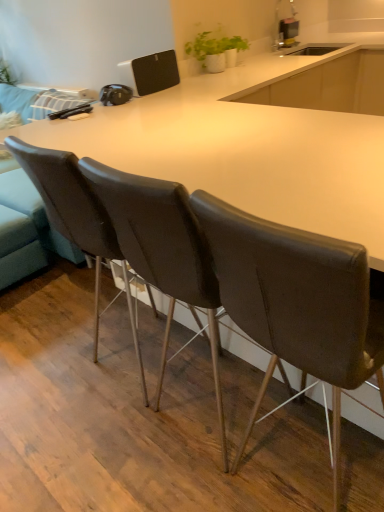
Question: Does metallic silver toaster at upper center have a greater height compared to leather at center, the 2th chair in the left-to-right sequence?

Choices:
 (A) no
 (B) yes

Answer: (A)

Question: Is metallic silver toaster at upper center not close to leather at center, the 2th chair in the left-to-right sequence?

Choices:
 (A) no
 (B) yes

Answer: (B)

Question: From a real-world perspective, is metallic silver toaster at upper center positioned under leather at center, the 2th chair positioned from the right, based on gravity?

Choices:
 (A) no
 (B) yes

Answer: (A)

Question: Does metallic silver toaster at upper center have a lesser width compared to leather at center, the 2th chair positioned from the right?

Choices:
 (A) no
 (B) yes

Answer: (B)

Question: Is leather at center, the 2th chair positioned from the right, located within metallic silver toaster at upper center?

Choices:
 (A) yes
 (B) no

Answer: (B)

Question: Is metallic silver toaster at upper center positioned behind leather at center, the 2th chair positioned from the right?

Choices:
 (A) no
 (B) yes

Answer: (B)

Question: Is leather at left, which appears as the 1th chair when viewed from the left, far from metallic silver toaster at upper center?

Choices:
 (A) no
 (B) yes

Answer: (B)

Question: Could you tell me if leather at left, the 3th chair when ordered from right to left, is turned towards metallic silver toaster at upper center?

Choices:
 (A) no
 (B) yes

Answer: (A)

Question: Is leather at left, the 3th chair when ordered from right to left, thinner than metallic silver toaster at upper center?

Choices:
 (A) no
 (B) yes

Answer: (A)

Question: Is leather at left, the 3th chair when ordered from right to left, at the left side of metallic silver toaster at upper center?

Choices:
 (A) no
 (B) yes

Answer: (B)

Question: From a real-world perspective, is leather at left, which appears as the 1th chair when viewed from the left, beneath metallic silver toaster at upper center?

Choices:
 (A) no
 (B) yes

Answer: (B)

Question: Could metallic silver toaster at upper center be considered to be inside leather at left, which appears as the 1th chair when viewed from the left?

Choices:
 (A) yes
 (B) no

Answer: (B)

Question: Considering the relative positions of white matte pot at upper center and leather at center, the 2th chair positioned from the right, in the image provided, is white matte pot at upper center to the left of leather at center, the 2th chair positioned from the right, from the viewer's perspective?

Choices:
 (A) no
 (B) yes

Answer: (A)